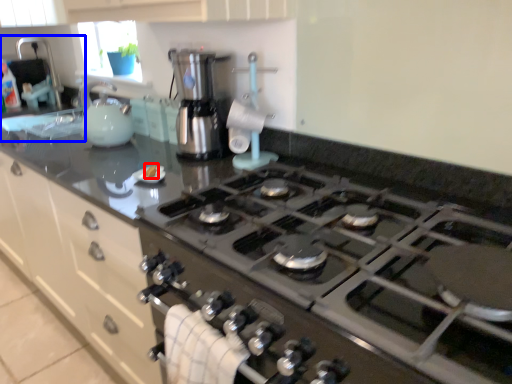
Question: Which object appears closest to the camera in this image, food (highlighted by a red box) or sink (highlighted by a blue box)?

Choices:
 (A) food
 (B) sink

Answer: (A)